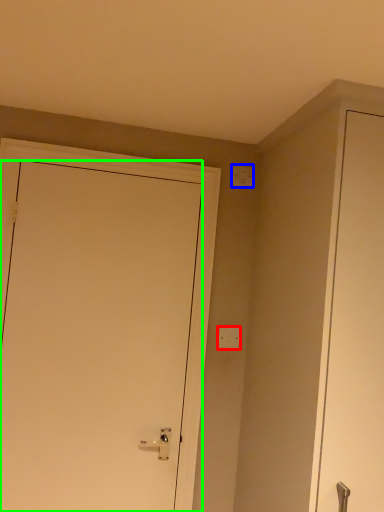
Question: Estimate the real-world distances between objects in this image. Which object is closer to light switch (highlighted by a red box), light switch (highlighted by a blue box) or door (highlighted by a green box)?

Choices:
 (A) light switch
 (B) door

Answer: (B)